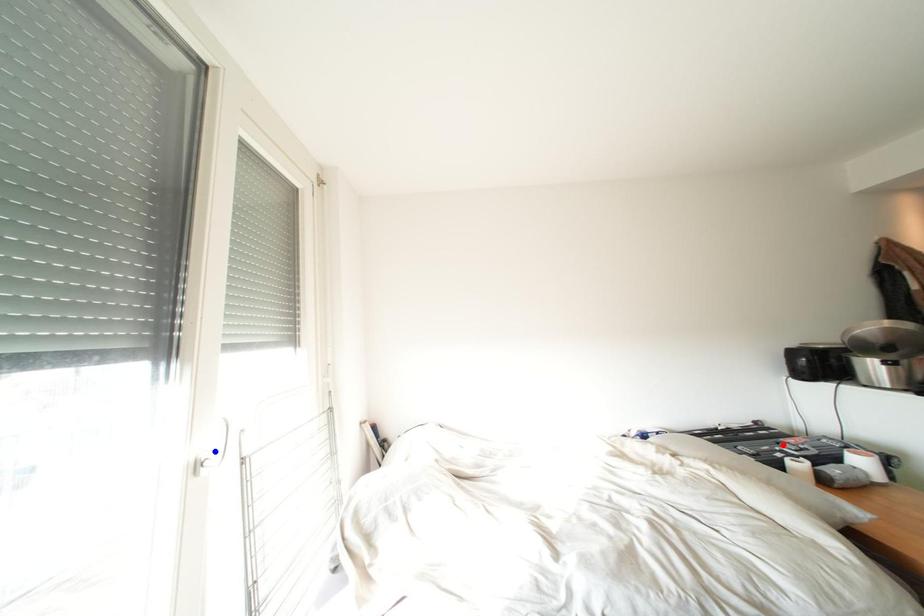
Question: In the image, two points are highlighted. Which point is nearer to the camera? Reply with the corresponding letter.

Choices:
 (A) blue point
 (B) red point

Answer: (A)